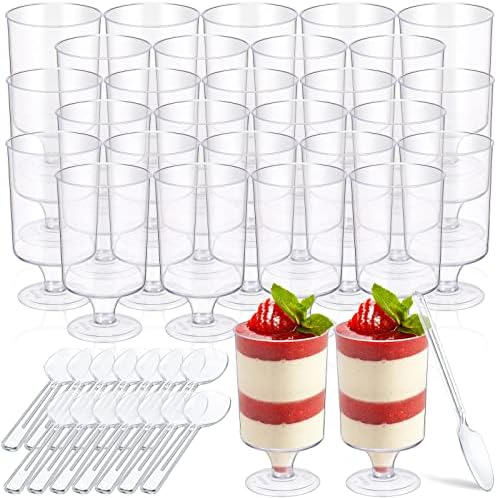
Find the location of `surface`. surface is located at coordinates (229, 473).